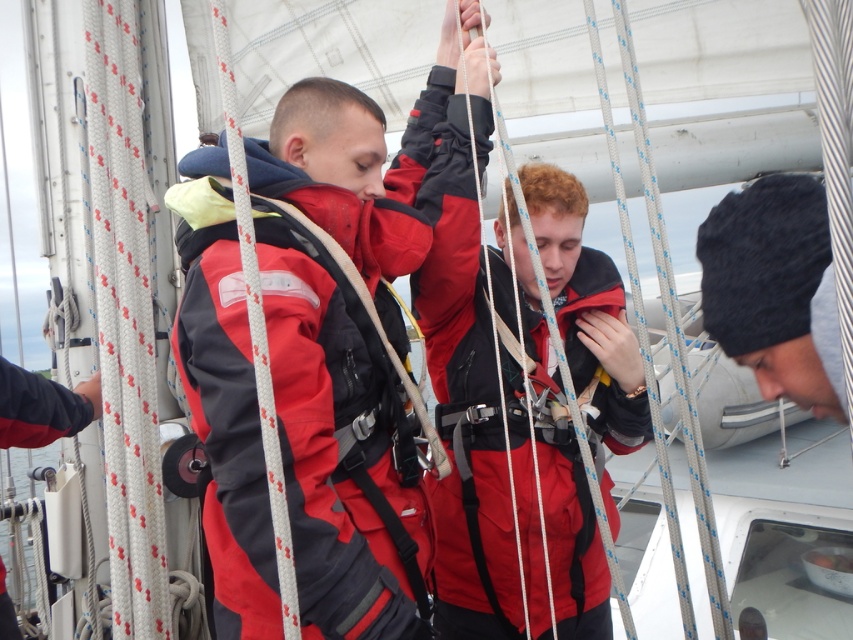
Can you confirm if matte black jacket at center is positioned to the left of black knit cap at lower right?

Correct, you'll find matte black jacket at center to the left of black knit cap at lower right.

Does point (558, 502) come in front of point (780, 339)?

No, it is behind (780, 339).

Between point (459, 404) and point (807, 193), which one is positioned behind?

Positioned behind is point (459, 404).

Identify the location of matte black jacket at center. (495, 444).

Looking at this image, does red matte jacket at center have a greater width compared to matte black jacket at center?

No.

Consider the image. Who is taller, red matte jacket at center or matte black jacket at center?

Standing taller between the two is matte black jacket at center.

Locate an element on the screen. The height and width of the screenshot is (640, 853). red matte jacket at center is located at coordinates (335, 452).

Which is above, red matte jacket at center or black knit cap at lower right?

red matte jacket at center is above.

Is red matte jacket at center smaller than black knit cap at lower right?

Actually, red matte jacket at center might be larger than black knit cap at lower right.

Who is more distant from viewer, (241, 492) or (708, 320)?

Positioned behind is point (241, 492).

Where is `red matte jacket at center`? This screenshot has width=853, height=640. red matte jacket at center is located at coordinates (335, 452).